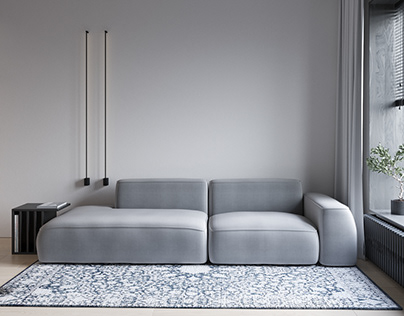
At what (x,y) coordinates should I click in order to perform the action: click on window shades. Please return your answer as a coordinate pair (x, y). Looking at the image, I should click on (397, 64).